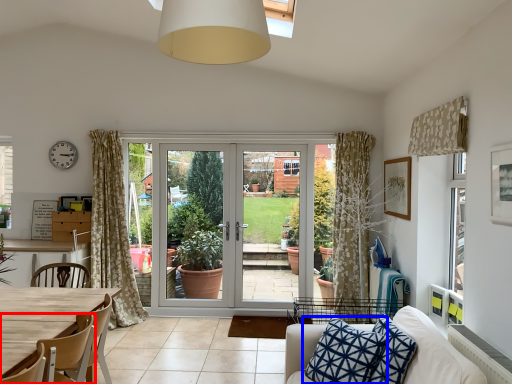
Question: Which object appears closest to the camera in this image, chair (highlighted by a red box) or pillow (highlighted by a blue box)?

Choices:
 (A) chair
 (B) pillow

Answer: (A)